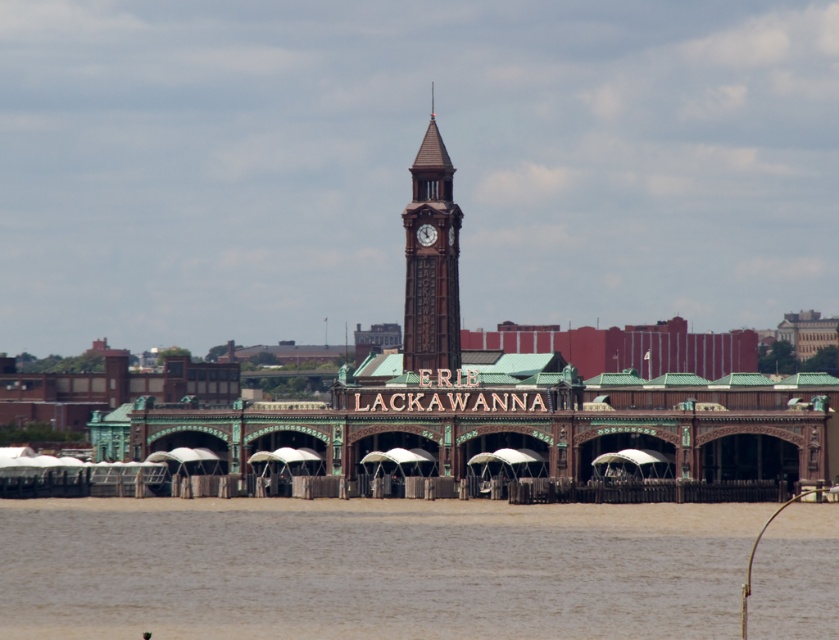
You are an architect examining the Erie Lackawanna Railway Station. You notice the brown wooden clock tower at center and the wooden clock at center. Which object has a greater width?

The brown wooden clock tower at center has a greater width than the wooden clock at center according to the description.

You are a tourist standing in front of the Erie Lackawanna Railway Station. You notice the brown wooden clock tower at center and the wooden clock at center. Which one is taller?

The brown wooden clock tower at center is much taller than the wooden clock at center.